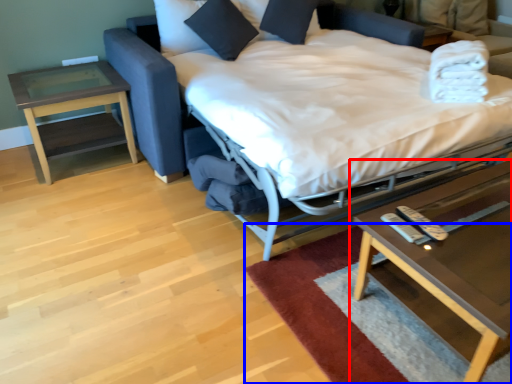
Question: Which point is closer to the camera, coffee table (highlighted by a red box) or mat (highlighted by a blue box)?

Choices:
 (A) coffee table
 (B) mat

Answer: (A)